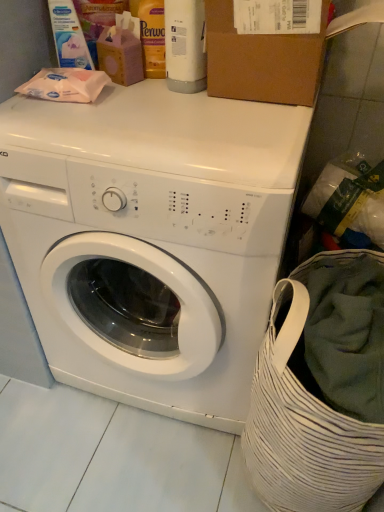
Identify the location of free spot in front of brown cardboard box at upper center. (244, 137).